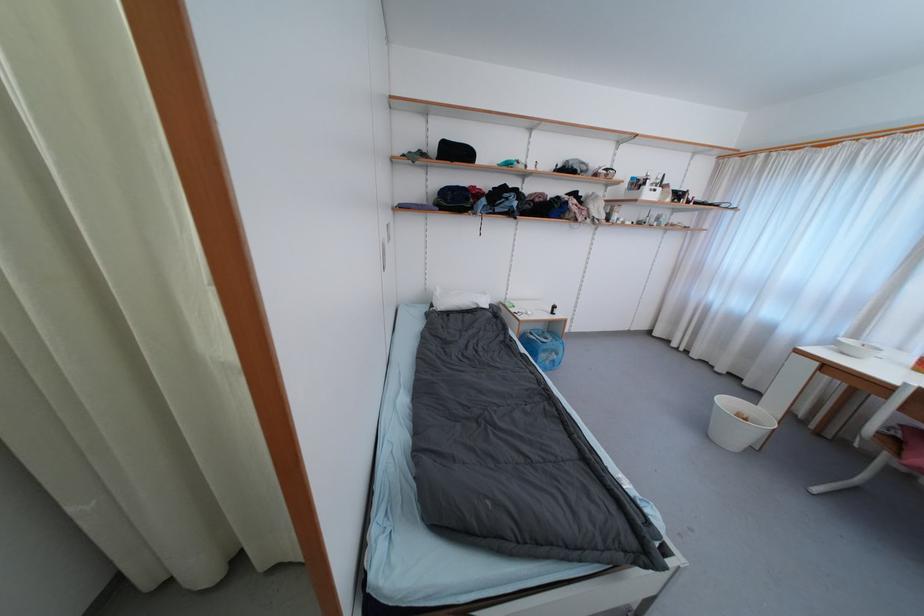
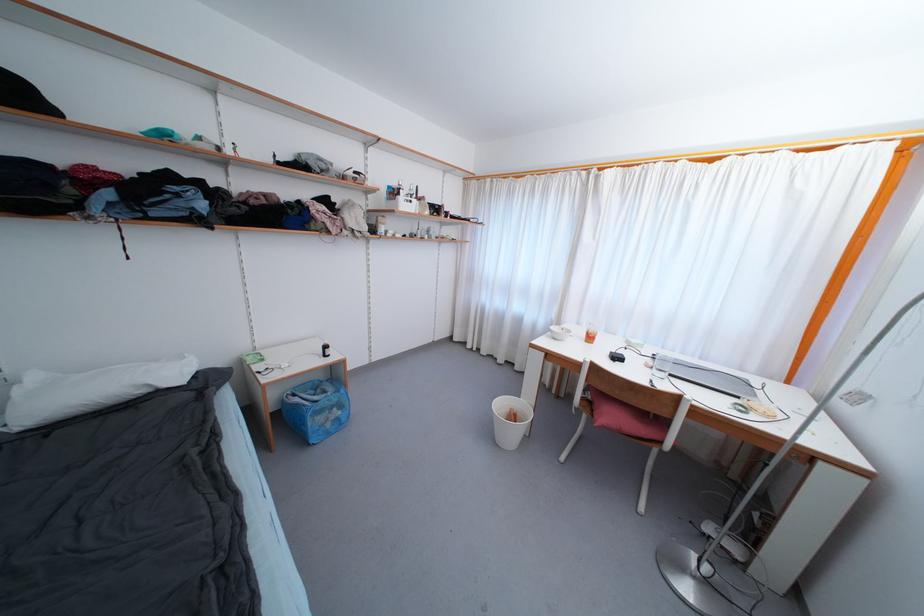
Locate, in the second image, the point that corresponds to point 732,405 in the first image.

(505, 407)